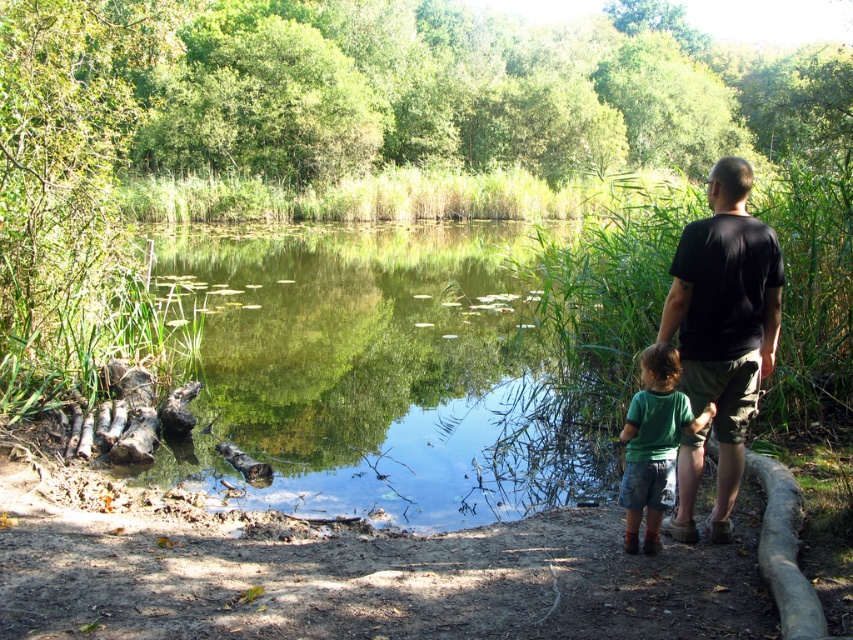
Question: Considering the relative positions of green reflective water at center and green cotton shirt at lower center in the image provided, where is green reflective water at center located with respect to green cotton shirt at lower center?

Choices:
 (A) right
 (B) left

Answer: (B)

Question: Which of these objects is positioned farthest from the black cotton shirt at right?

Choices:
 (A) green reflective water at center
 (B) green cotton shirt at lower center

Answer: (A)

Question: Is black cotton shirt at right above green cotton shirt at lower center?

Choices:
 (A) yes
 (B) no

Answer: (A)

Question: Does green reflective water at center lie in front of black cotton shirt at right?

Choices:
 (A) no
 (B) yes

Answer: (A)

Question: Estimate the real-world distances between objects in this image. Which object is farther from the green cotton shirt at lower center?

Choices:
 (A) black cotton shirt at right
 (B) green reflective water at center

Answer: (B)

Question: Which object is farther from the camera taking this photo?

Choices:
 (A) green cotton shirt at lower center
 (B) black cotton shirt at right

Answer: (B)